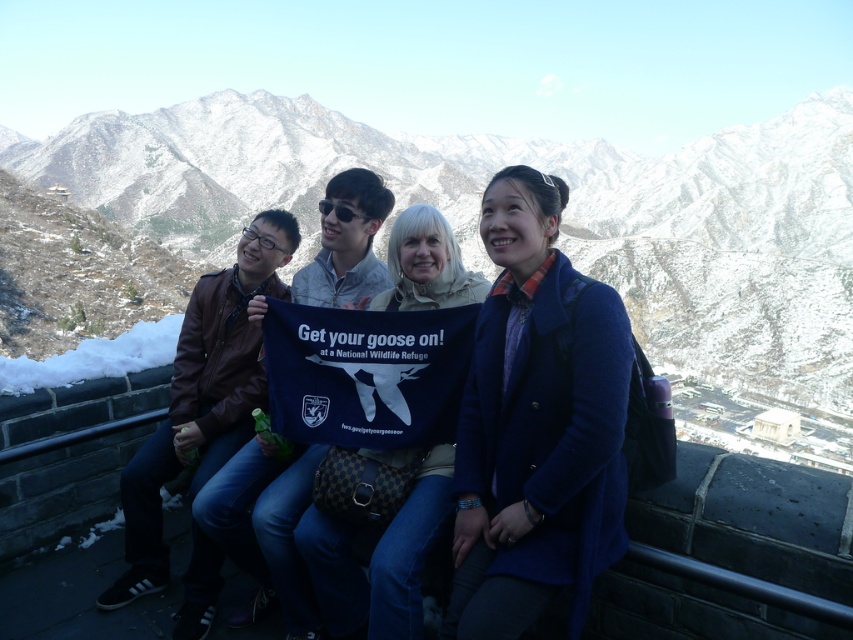
Question: Which is nearer to the snowy rock formation at upper center?

Choices:
 (A) blue woolen coat at center
 (B) blue fabric banner at center

Answer: (A)

Question: Is snowy rock formation at upper center behind blue fabric banner at center?

Choices:
 (A) no
 (B) yes

Answer: (B)

Question: Which point appears farthest from the camera in this image?

Choices:
 (A) (821, 209)
 (B) (395, 600)

Answer: (A)

Question: Which object is closer to the camera taking this photo?

Choices:
 (A) blue woolen coat at center
 (B) snowy rock formation at upper center

Answer: (A)

Question: Does snowy rock formation at upper center appear on the right side of blue fabric banner at center?

Choices:
 (A) yes
 (B) no

Answer: (A)

Question: Does snowy rock formation at upper center appear on the right side of blue fabric banner at center?

Choices:
 (A) no
 (B) yes

Answer: (B)